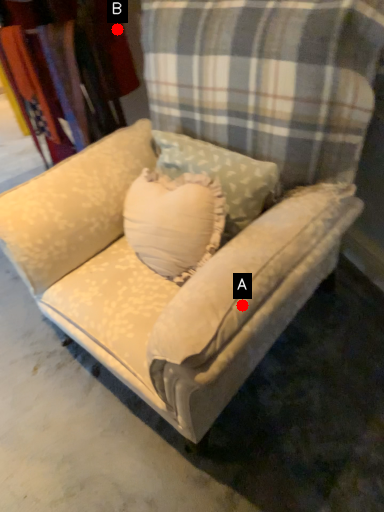
Question: Two points are circled on the image, labeled by A and B beside each circle. Among these points, which one is farthest from the camera?

Choices:
 (A) A is further
 (B) B is further

Answer: (B)